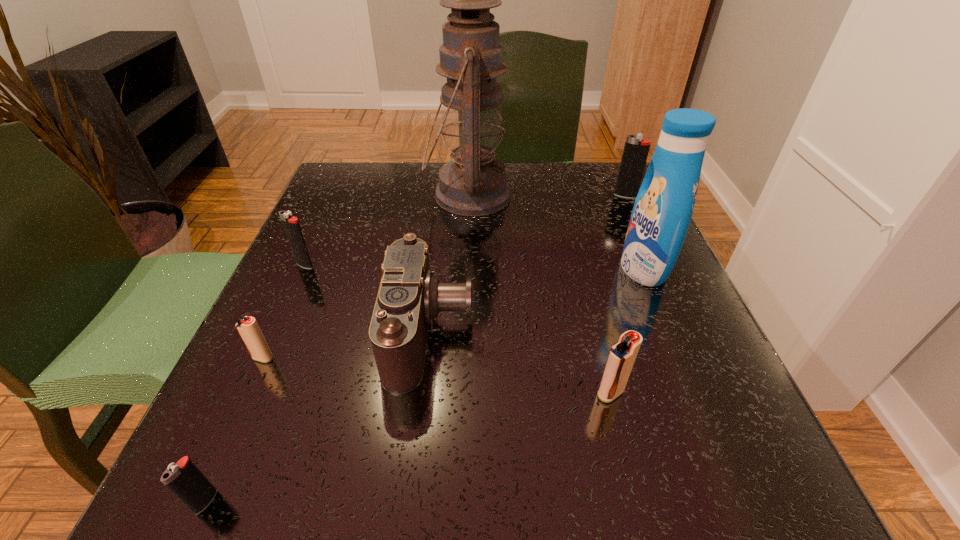
You are a GUI agent. You are given a task and a screenshot of the screen. Output one action in this format:
    pyautogui.click(x=<x>, y=<y>)
    Task: Click on the third nearest igniter
    
    Given the screenshot: What is the action you would take?
    pyautogui.click(x=248, y=328)

Image resolution: width=960 pixels, height=540 pixels. Find the location of `the farther red igniter`. the farther red igniter is located at coordinates (248, 328).

Where is `the nearest object`? the nearest object is located at coordinates (184, 479).

Find the location of `the smallest black igniter`. the smallest black igniter is located at coordinates (184, 479).

Locate an element on the screen. Image resolution: width=960 pixels, height=540 pixels. vacant space situated 0.210m on the left of the tallest object is located at coordinates (336, 195).

Where is `free space located 0.360m on the front-facing side of the seventh shortest object`? free space located 0.360m on the front-facing side of the seventh shortest object is located at coordinates (433, 268).

The image size is (960, 540). In order to click on vacant space located 0.360m on the front-facing side of the seventh shortest object in this screenshot , I will do `click(433, 268)`.

At what (x,y) coordinates should I click in order to perform the action: click on free space located 0.390m on the front-facing side of the seventh shortest object. Please return your answer as a coordinate pair (x, y). This screenshot has width=960, height=540. Looking at the image, I should click on (417, 268).

You are a GUI agent. You are given a task and a screenshot of the screen. Output one action in this format:
    pyautogui.click(x=<x>, y=<y>)
    Task: Click on the free spot located 0.070m on the front of the tallest igniter
    
    Given the screenshot: What is the action you would take?
    pyautogui.click(x=635, y=215)

Where is `blank space located 0.380m on the front-facing side of the camera`? This screenshot has height=540, width=960. blank space located 0.380m on the front-facing side of the camera is located at coordinates coord(706,331).